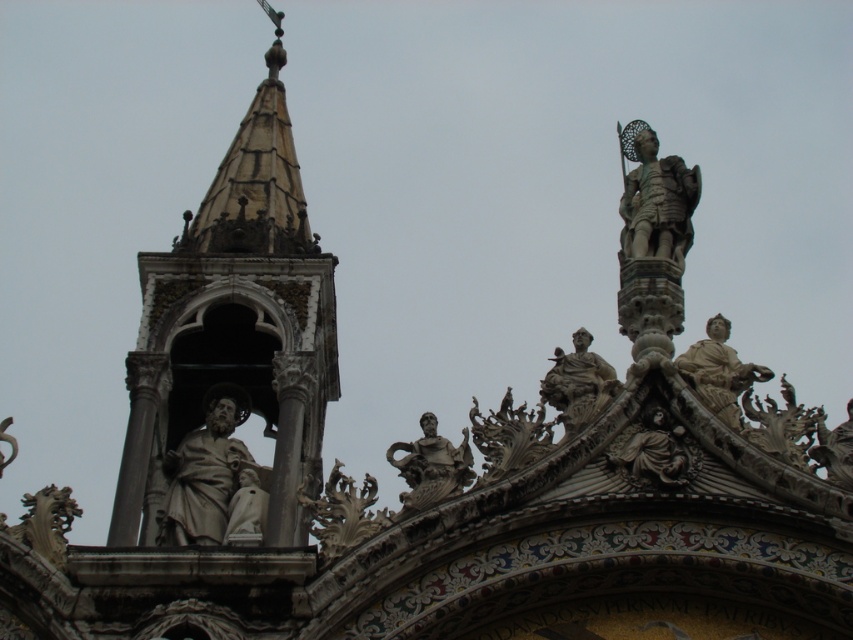
In the scene shown: You are standing in front of the ornate architectural structure and notice a point at coordinates (210,474). Which object from the scene does this coordinate point to?

The point at coordinates (210,474) corresponds to the beige stone statue at center left.

You are an architect reviewing the layout of the structure. You need to place a new decorative element exactly at the center of the image. Is the polished bronze statue at center currently positioned at that spot?

The polished bronze statue at center is located at point (430,467), which is not the exact center of the image. The center would be at coordinates like (426,320), so the statue is offset to the right and slightly lower.